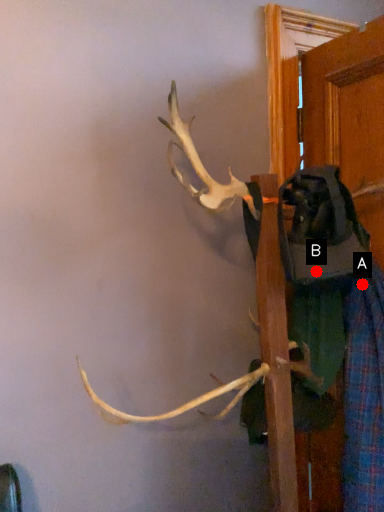
Question: Two points are circled on the image, labeled by A and B beside each circle. Which of the following is the farthest from the observer?

Choices:
 (A) A is further
 (B) B is further

Answer: (A)